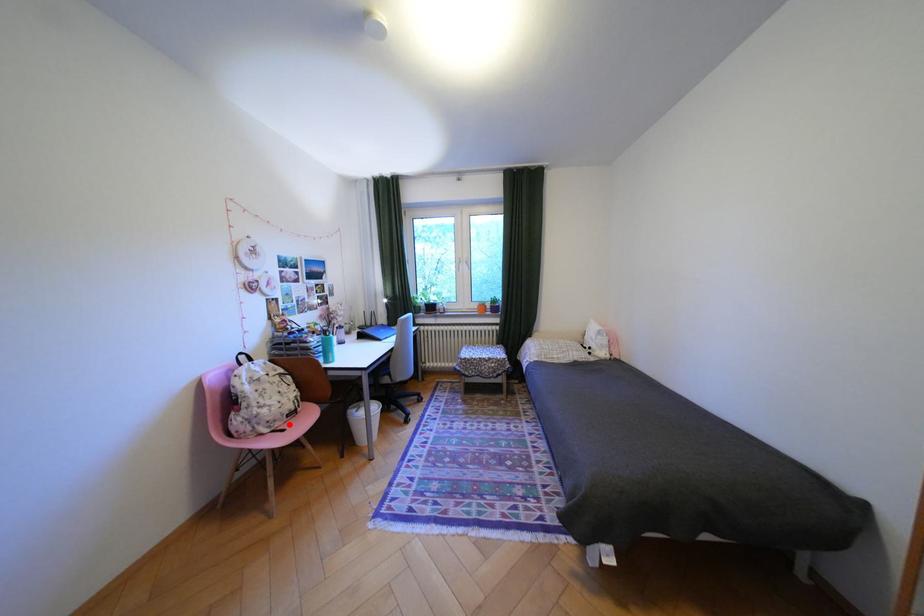
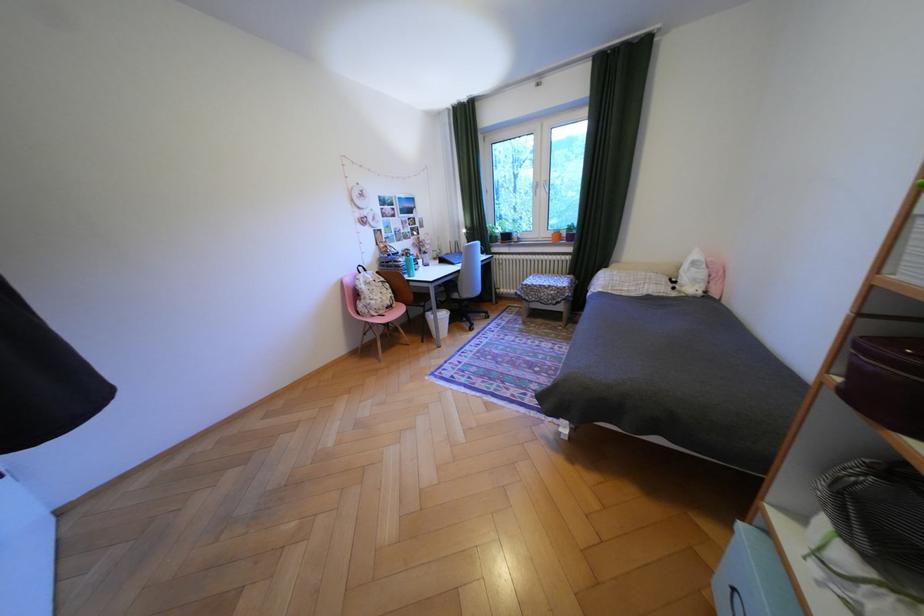
In the second image, find the point that corresponds to the highlighted location in the first image.

(393, 312)